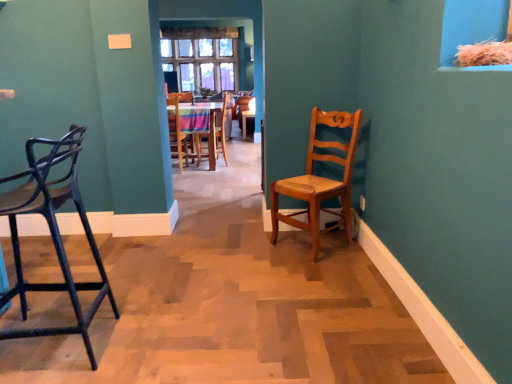
Question: Is wooden chair at center, the third chair in the back-to-front sequence, to the left of wooden chair at center, which is counted as the second chair, starting from the back, from the viewer's perspective?

Choices:
 (A) yes
 (B) no

Answer: (A)

Question: From the image's perspective, is wooden chair at center, the third chair in the back-to-front sequence, under wooden chair at center, which is counted as the second chair, starting from the back?

Choices:
 (A) no
 (B) yes

Answer: (B)

Question: Is wooden chair at center, the third chair in the back-to-front sequence, outside of wooden chair at center, which is counted as the second chair, starting from the back?

Choices:
 (A) no
 (B) yes

Answer: (A)

Question: Would you say wooden chair at center, the 3th chair positioned from the front, contains wooden chair at center, the 4th chair from the front?

Choices:
 (A) yes
 (B) no

Answer: (B)

Question: From the image's perspective, is wooden chair at center, the 3th chair positioned from the front, located above wooden chair at center, which is counted as the second chair, starting from the back?

Choices:
 (A) no
 (B) yes

Answer: (A)

Question: Are wooden chair at center, the third chair in the back-to-front sequence, and wooden chair at center, the 4th chair from the front, making contact?

Choices:
 (A) no
 (B) yes

Answer: (A)

Question: From a real-world perspective, does wooden chair at center, the fifth chair when ordered from front to back, stand above light brown wooden chair at center, which ranks as the fourth chair in back-to-front order?

Choices:
 (A) no
 (B) yes

Answer: (B)

Question: Is wooden chair at center, the fifth chair when ordered from front to back, surrounding light brown wooden chair at center, which ranks as the fourth chair in back-to-front order?

Choices:
 (A) yes
 (B) no

Answer: (B)

Question: From the image's perspective, is wooden chair at center, the first chair when ordered from back to front, over light brown wooden chair at center, which ranks as the fourth chair in back-to-front order?

Choices:
 (A) yes
 (B) no

Answer: (A)

Question: Considering the relative sizes of wooden chair at center, the fifth chair when ordered from front to back, and light brown wooden chair at center, which ranks as the fourth chair in back-to-front order, in the image provided, is wooden chair at center, the fifth chair when ordered from front to back, smaller than light brown wooden chair at center, which ranks as the fourth chair in back-to-front order,?

Choices:
 (A) yes
 (B) no

Answer: (A)

Question: Is wooden chair at center, the fifth chair when ordered from front to back, far away from light brown wooden chair at center, which ranks as the fourth chair in back-to-front order?

Choices:
 (A) no
 (B) yes

Answer: (B)

Question: From a real-world perspective, does wooden chair at center, the first chair when ordered from back to front, sit lower than light brown wooden chair at center, which ranks as the fourth chair in back-to-front order?

Choices:
 (A) yes
 (B) no

Answer: (B)

Question: Is light brown wooden chair at center, which is counted as the 2th chair, starting from the front, to the right of wooden chair at center, the 4th chair from the front, from the viewer's perspective?

Choices:
 (A) no
 (B) yes

Answer: (B)